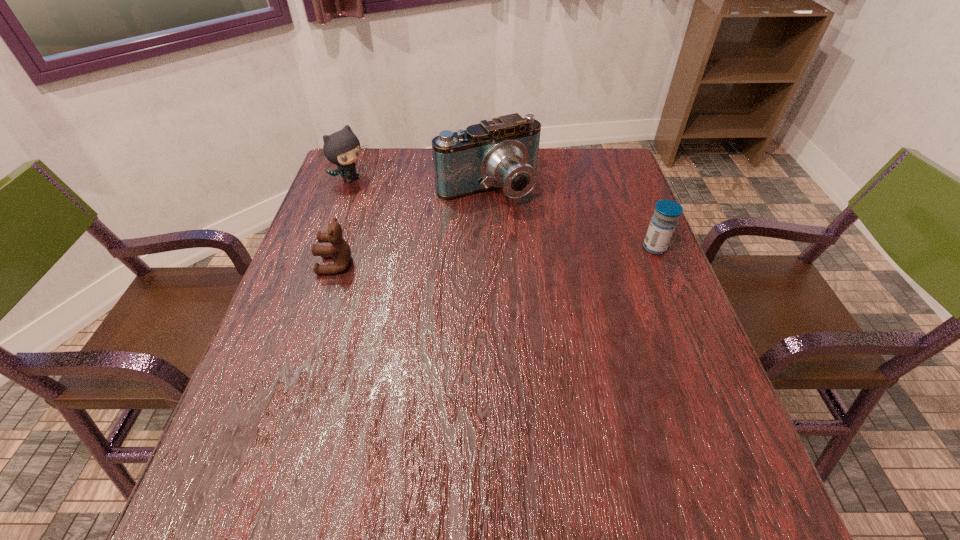
At what (x,y) coordinates should I click in order to perform the action: click on free spot on the desktop that is between the teddy bear and the medicine and is positioned on the front-facing side of the second object from right to left. Please return your answer as a coordinate pair (x, y). This screenshot has width=960, height=540. Looking at the image, I should click on (537, 254).

Image resolution: width=960 pixels, height=540 pixels. In order to click on vacant space on the desktop that is between the teddy bear and the rightmost object and is positioned on the front-facing side of the kitten in this screenshot , I will do `click(486, 256)`.